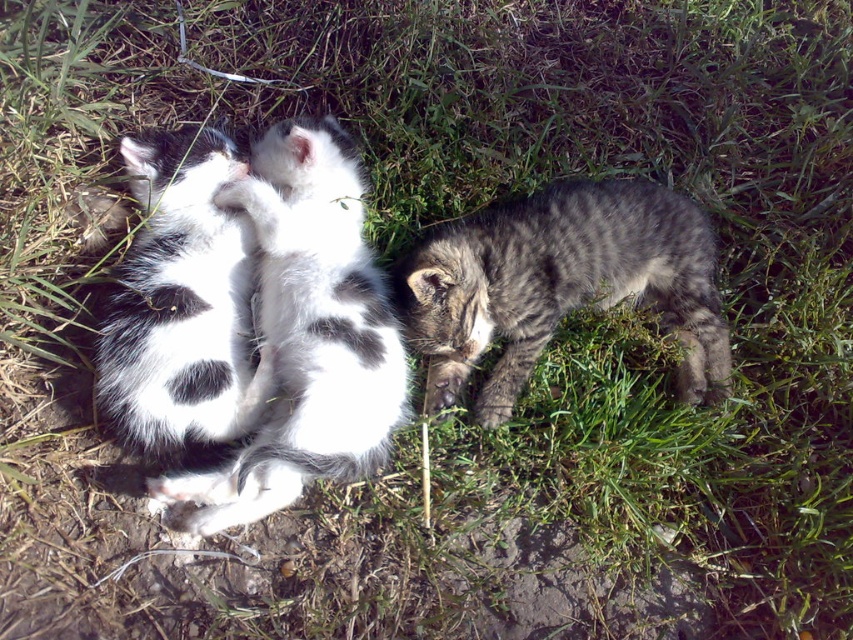
Consider the image. You are a photographer trying to capture a photo of the gray striped kitten at center and the white soft fur kitten at center. Which kitten should you focus on if you want to ensure the one that is taller is in the frame first?

The white soft fur kitten at center is taller than the gray striped kitten at center, so you should focus on the white soft fur kitten at center first to ensure it is in the frame.

You are a photographer trying to capture a closeup of the black and white fur kitten at center and the white soft fur kitten at center. Which kitten will appear larger in your photo?

The black and white fur kitten at center will appear larger in the photo because it is closer to the viewer than the white soft fur kitten at center.

In the serene outdoor scene with three kittens on grass, you notice two kittens at the center. The black and white fur kitten at center and the white soft fur kitten at center. Which one is positioned to the right?

The black and white fur kitten at center is positioned to the right of the white soft fur kitten at center.